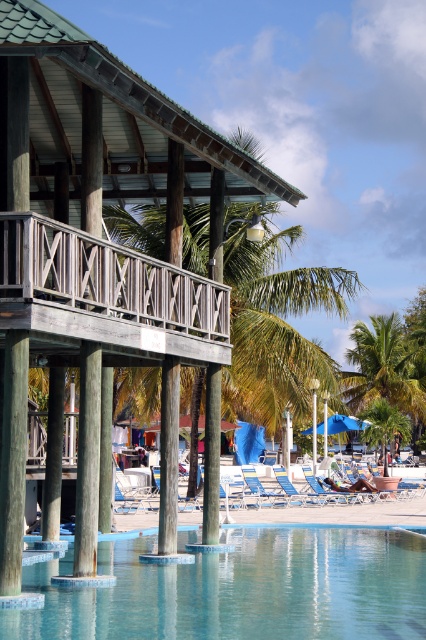
What is located at the point with coordinates (109, 202) in the image?

The point with coordinates (109, 202) indicates the wooden hut at center.

You are a guest staying at this resort and want to place a 2m wide lounge chair between the wooden hut at center and the blue fabric umbrella at center. Can you fit it there?

The wooden hut at center is wider than the blue fabric umbrella at center. Since the lounge chair is 2 meters wide, you need to check the distance between them. However, the description only provides information about their widths, not the space between them. Therefore, it is unclear if there is enough room to fit the lounge chair between them based on the given information.

You are standing at the edge of the pool and want to sit on the blue fabric beach chair at center. Is the wooden hut at center blocking your path to the chair?

The wooden hut at center is in front of the blue fabric beach chair at center, so it is blocking the path to the chair.